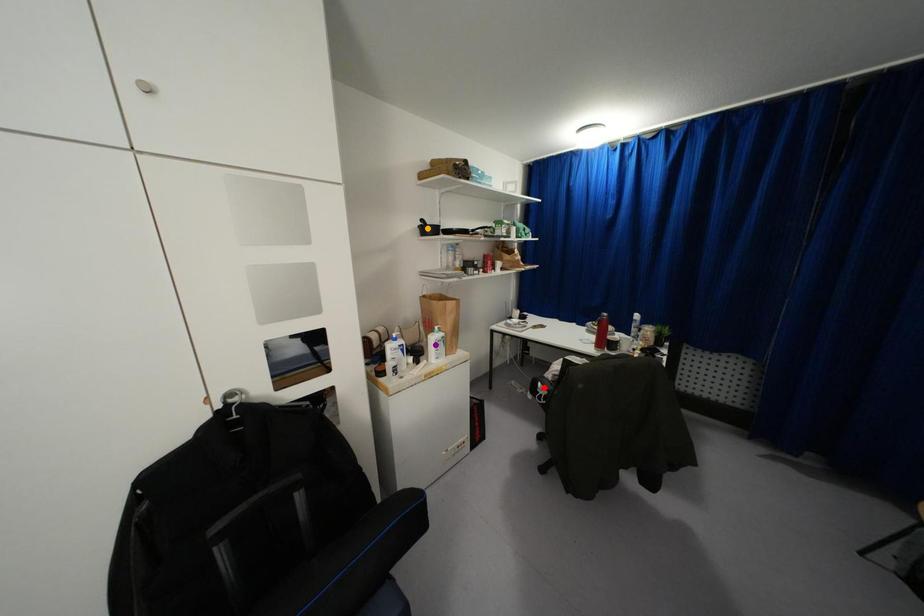
Order these from farthest to nearest:
red point
orange point
purple point

1. red point
2. orange point
3. purple point